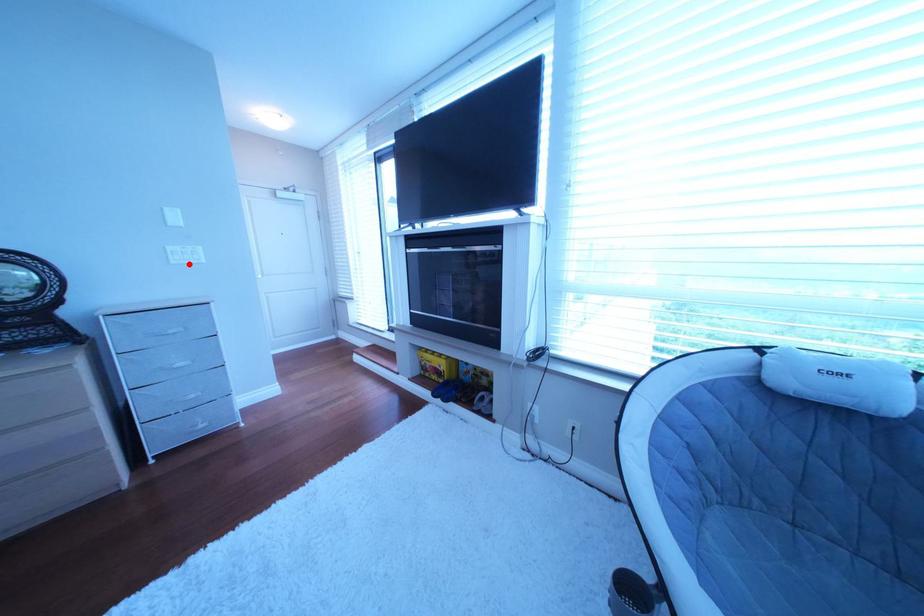
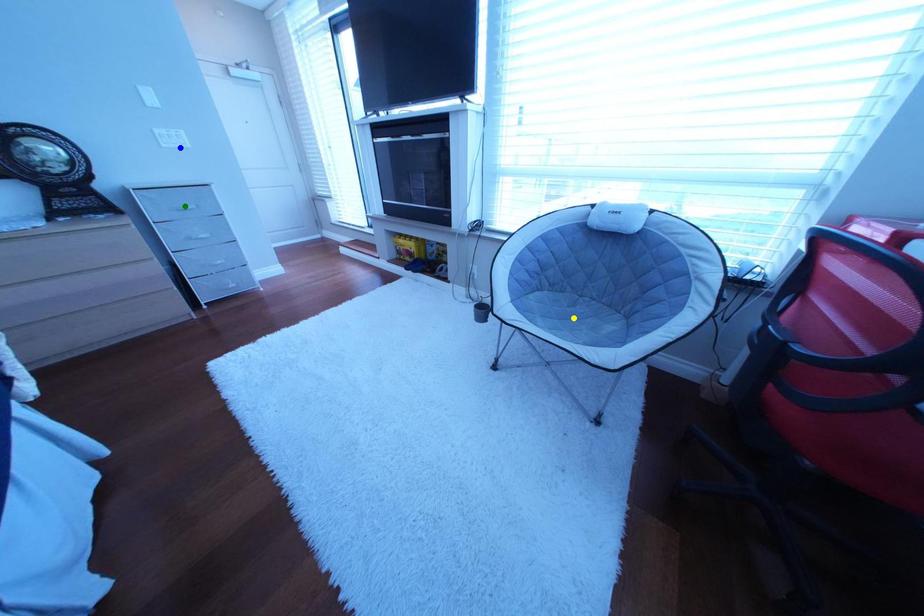
Question: I am providing you with two images of the same scene from different viewpoints. A red point is marked on the first image. You are given multiple points on the second image. In image 2, which mark is for the same physical point as the one in image 1?

Choices:
 (A) yellow point
 (B) green point
 (C) blue point

Answer: (C)